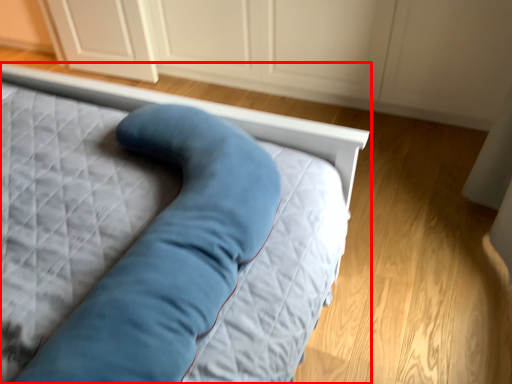
Question: From the image's perspective, considering the relative positions of bed (annotated by the red box) and dresser in the image provided, where is bed (annotated by the red box) located with respect to the staircase?

Choices:
 (A) below
 (B) above

Answer: (A)